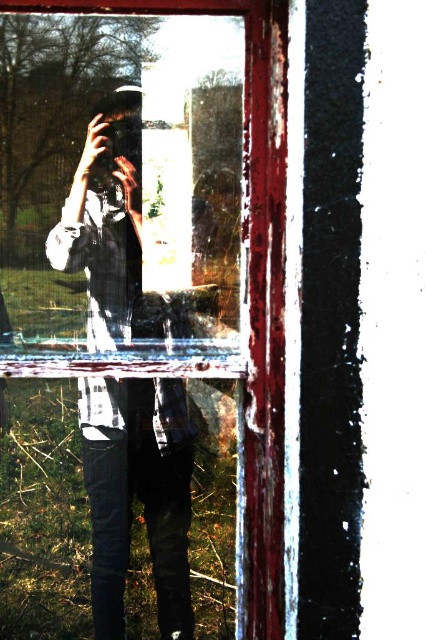
Is matte black camera at center to the right of chipped paint window frame at center from the viewer's perspective?

In fact, matte black camera at center is to the left of chipped paint window frame at center.

Which is more to the left, matte black camera at center or chipped paint window frame at center?

matte black camera at center is more to the left.

The height and width of the screenshot is (640, 426). What are the coordinates of `matte black camera at center` in the screenshot? It's located at (138, 493).

Where is `matte black camera at center`? This screenshot has height=640, width=426. matte black camera at center is located at coordinates (138, 493).